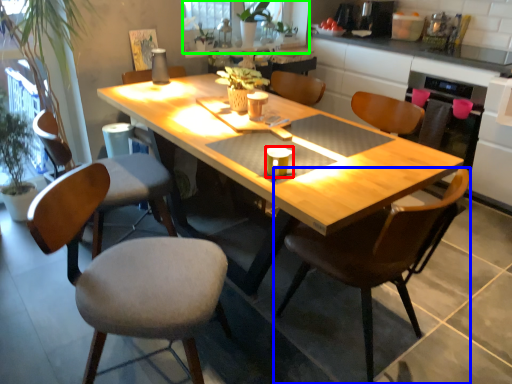
Question: Considering the real-world distances, which object is farthest from coffee cup (highlighted by a red box)? chair (highlighted by a blue box) or window screen (highlighted by a green box)?

Choices:
 (A) chair
 (B) window screen

Answer: (B)